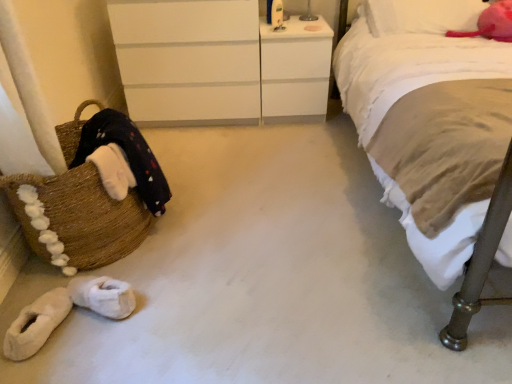
Find the location of a particular element. unoccupied region to the right of brown woven basket at left is located at coordinates (222, 228).